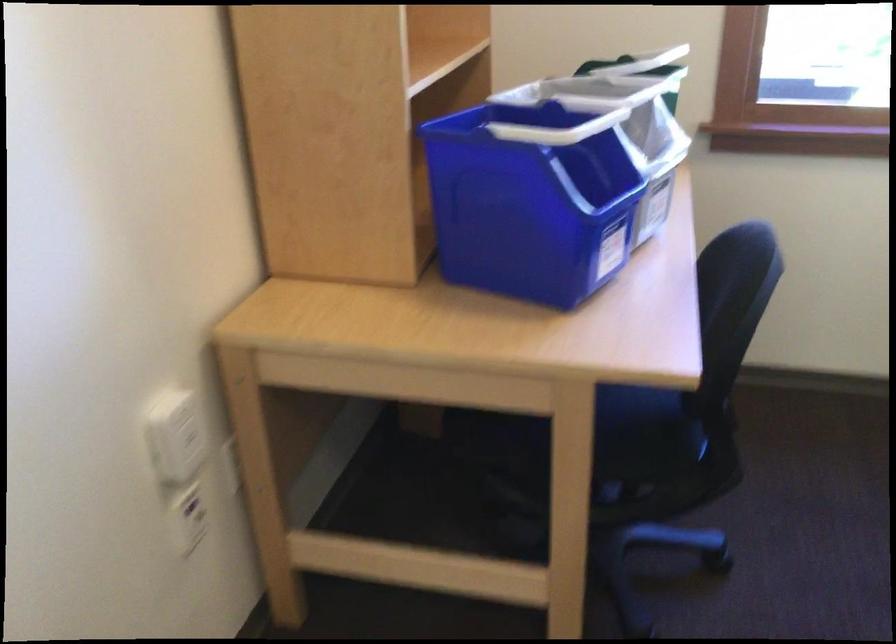
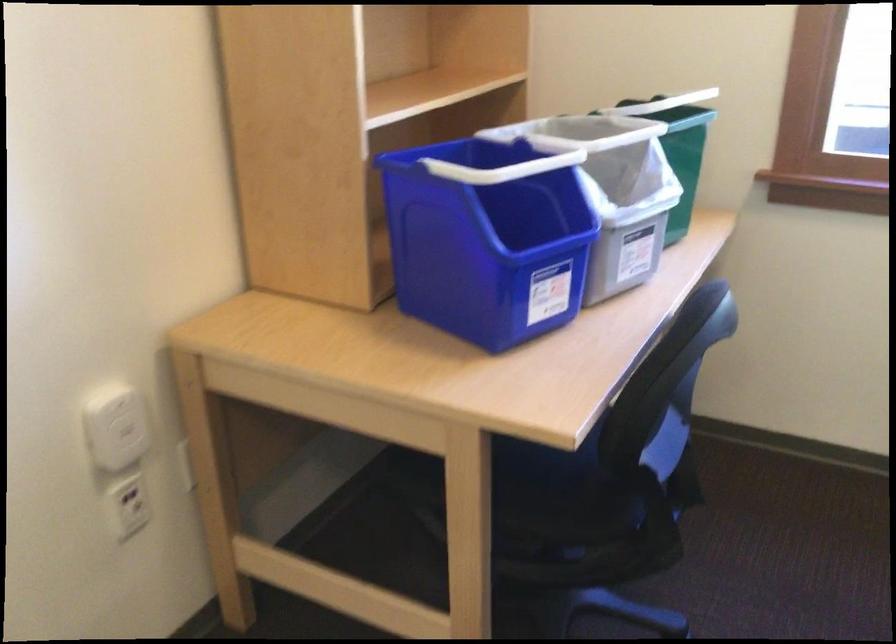
Question: The camera is either moving clockwise (left) or counter-clockwise (right) around the object. The first image is from the beginning of the video and the second image is from the end. Is the camera moving left or right when shooting the video?

Choices:
 (A) Left
 (B) Right

Answer: (B)